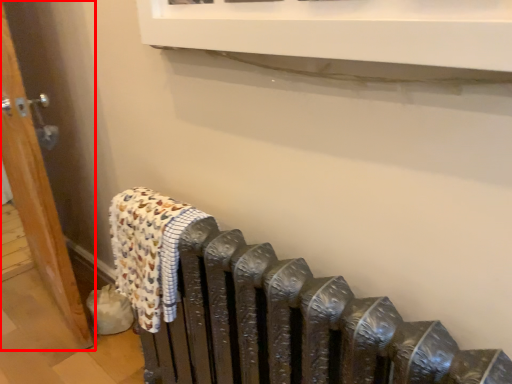
Question: From the image, what is the correct spatial relationship of door (annotated by the red box) in relation to bath towel?

Choices:
 (A) right
 (B) left

Answer: (B)